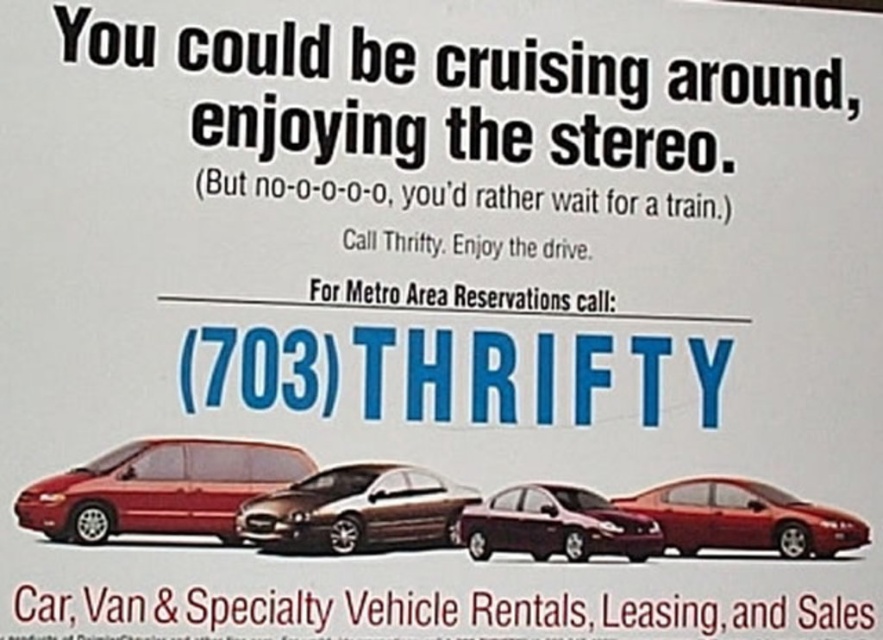
Is metallic brown sedan at center wider than glossy red car at lower right?

In fact, metallic brown sedan at center might be narrower than glossy red car at lower right.

This screenshot has height=640, width=883. Identify the location of metallic brown sedan at center. [x=357, y=509].

Between point (349, 524) and point (669, 502), which one is positioned in front?

Point (349, 524) is more forward.

Locate an element on the screen. The width and height of the screenshot is (883, 640). metallic brown sedan at center is located at coordinates (357, 509).

Based on the photo, between matte red minivan at left and metallic brown sedan at center, which one has less height?

Standing shorter between the two is metallic brown sedan at center.

Can you confirm if matte red minivan at left is taller than metallic brown sedan at center?

Correct, matte red minivan at left is much taller as metallic brown sedan at center.

You are a GUI agent. You are given a task and a screenshot of the screen. Output one action in this format:
    pyautogui.click(x=<x>, y=<y>)
    Task: Click on the matte red minivan at left
    The image size is (883, 640).
    Given the screenshot: What is the action you would take?
    pos(157,488)

Based on the photo, is metallic brown sedan at center to the left of satin burgundy sedan at center from the viewer's perspective?

Indeed, metallic brown sedan at center is positioned on the left side of satin burgundy sedan at center.

Is point (325, 536) positioned before point (577, 513)?

Yes, it is.

Is point (361, 548) positioned behind point (557, 541)?

That is False.

This screenshot has height=640, width=883. In order to click on metallic brown sedan at center in this screenshot , I will do `click(357, 509)`.